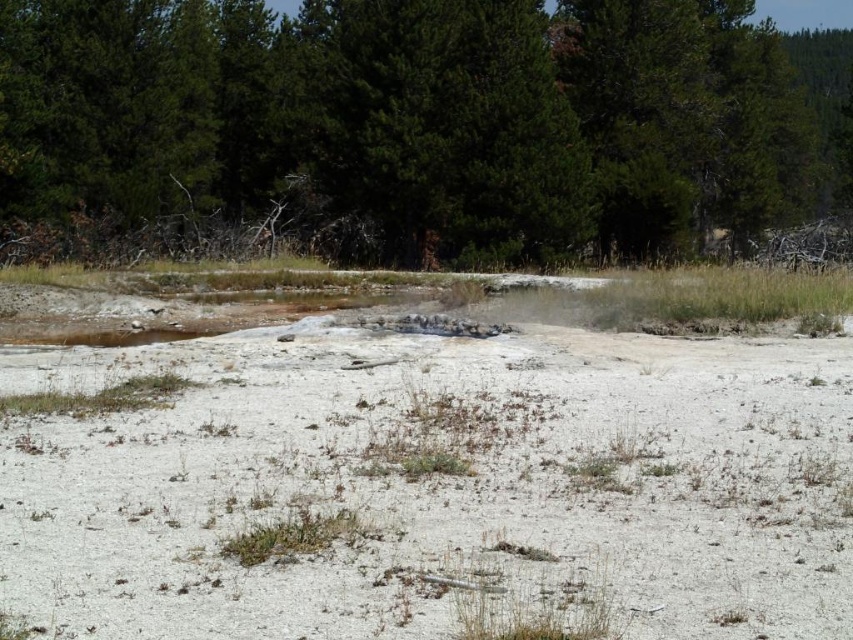
Question: Does white sandy dirt at center appear on the right side of green textured tree at upper center?

Choices:
 (A) yes
 (B) no

Answer: (B)

Question: Observing the image, what is the correct spatial positioning of white sandy dirt at center in reference to green textured tree at upper center?

Choices:
 (A) right
 (B) left

Answer: (B)

Question: Is white sandy dirt at center to the right of green textured tree at upper center from the viewer's perspective?

Choices:
 (A) yes
 (B) no

Answer: (B)